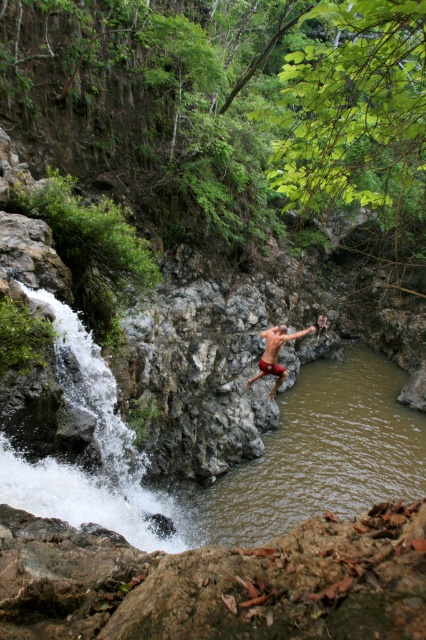
Question: Is brown rock stream at center positioned before matte red shorts at center?

Choices:
 (A) yes
 (B) no

Answer: (B)

Question: Is brown rock stream at center smaller than matte red shorts at center?

Choices:
 (A) no
 (B) yes

Answer: (A)

Question: From the image, what is the correct spatial relationship of brown rock stream at center in relation to matte red shorts at center?

Choices:
 (A) left
 (B) right

Answer: (B)

Question: Among these points, which one is farthest from the camera?

Choices:
 (A) (276, 451)
 (B) (252, 380)

Answer: (B)